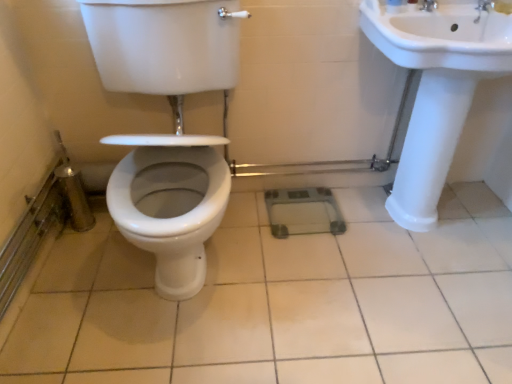
I want to click on vacant space to the right of white glossy toilet at center, so click(324, 289).